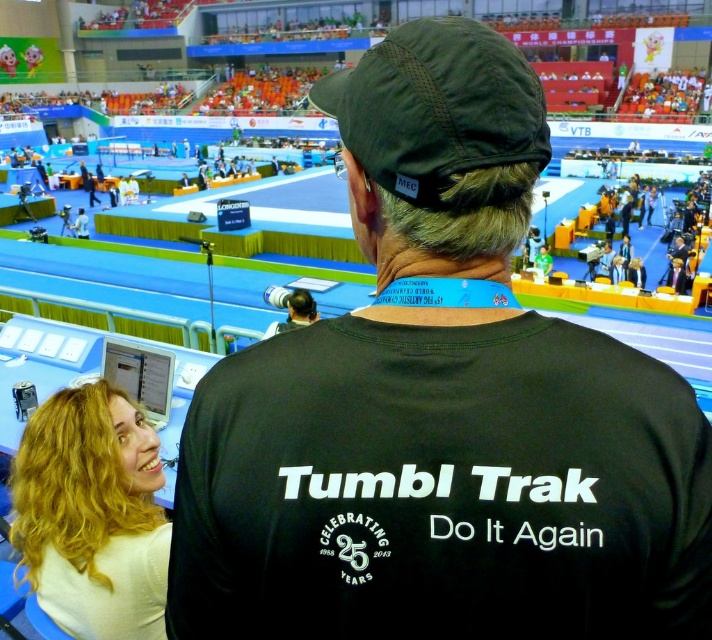
Question: Is black fabric shirt at center further to camera compared to blonde hair at upper left?

Choices:
 (A) yes
 (B) no

Answer: (B)

Question: Is black fabric shirt at center below dark green fabric baseball cap at upper center?

Choices:
 (A) yes
 (B) no

Answer: (A)

Question: Which object is closer to the camera taking this photo?

Choices:
 (A) blonde hair at upper left
 (B) dark green fabric baseball cap at upper center

Answer: (B)

Question: Which object is closer to the camera taking this photo?

Choices:
 (A) blonde hair at upper left
 (B) dark green fabric baseball cap at upper center
 (C) black fabric shirt at center

Answer: (C)

Question: Observing the image, what is the correct spatial positioning of black fabric shirt at center in reference to blonde hair at upper left?

Choices:
 (A) left
 (B) right

Answer: (B)

Question: Which point is farther to the camera?

Choices:
 (A) (28, 509)
 (B) (362, 531)
 (C) (379, 51)

Answer: (A)